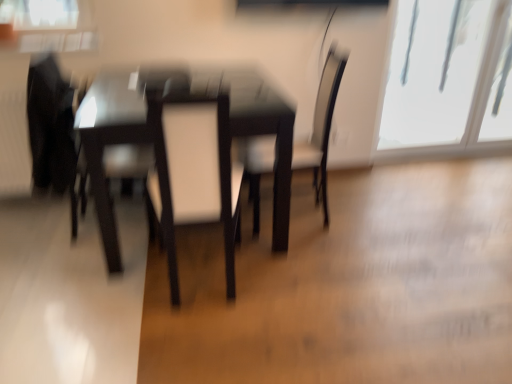
Where is `vacant region in front of matte black chair at center`? The image size is (512, 384). vacant region in front of matte black chair at center is located at coordinates (304, 264).